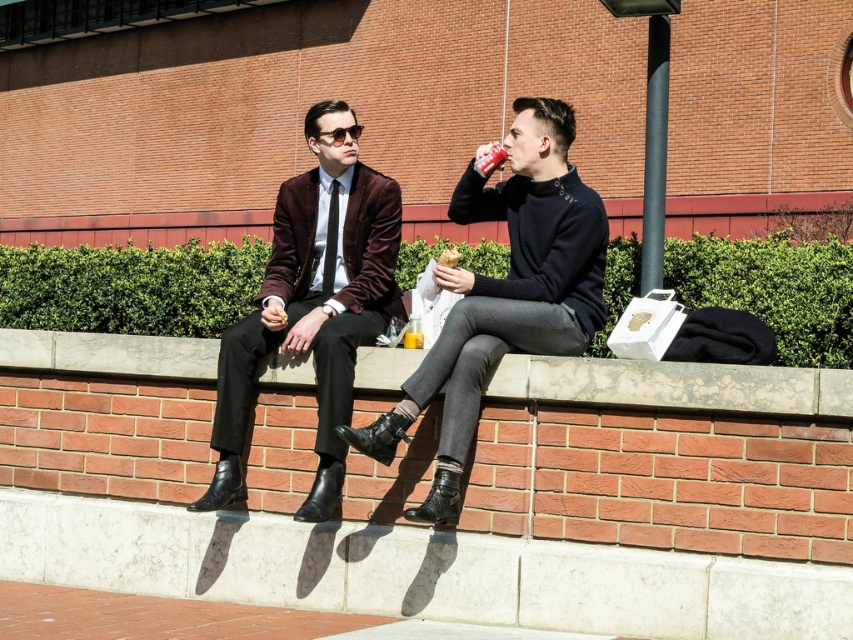
You are a tailor who needs to measure the velvet burgundy blazer at center and the smooth concrete ledge at center. Which object is taller?

The velvet burgundy blazer at center is taller than the smooth concrete ledge at center.